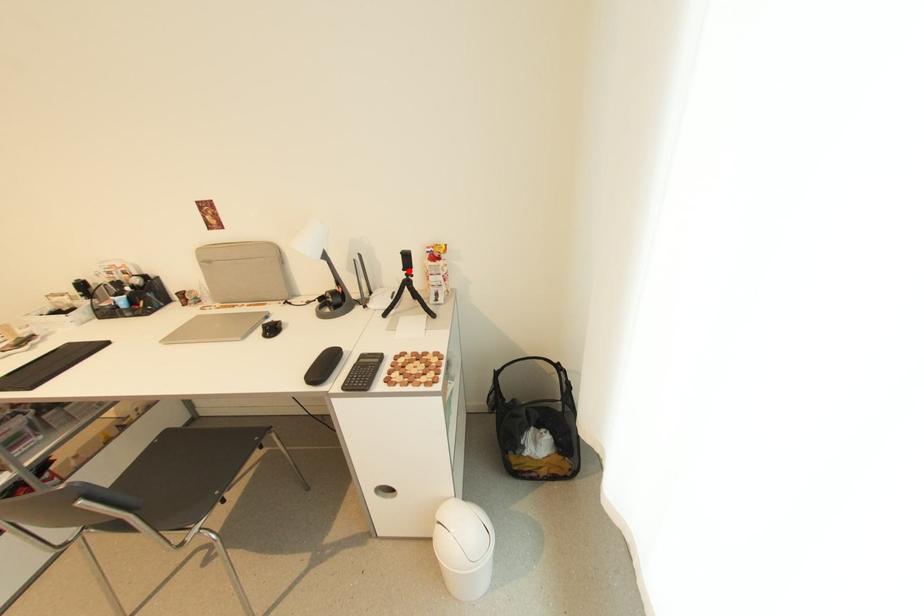
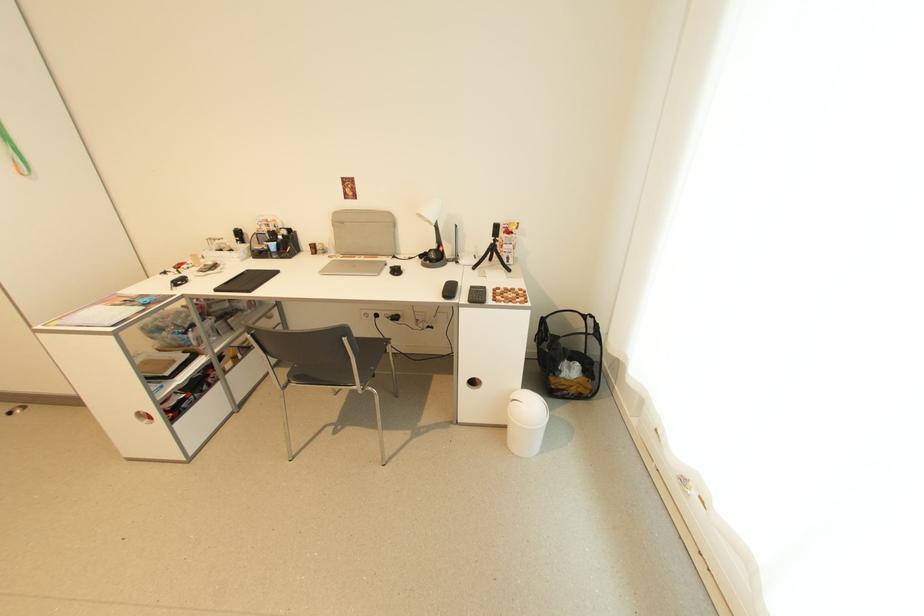
Question: I am providing you with two images of the same scene from different viewpoints. A red point is marked on the first image. Is the red point's position out of view in image 2?

Choices:
 (A) Yes
 (B) No

Answer: (B)